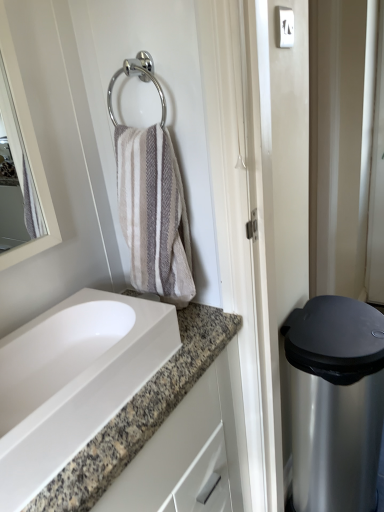
Question: Is chrome metallic towel ring at upper center at the back of satin silver trash can at right?

Choices:
 (A) yes
 (B) no

Answer: (B)

Question: Can you confirm if satin silver trash can at right is thinner than chrome metallic towel ring at upper center?

Choices:
 (A) no
 (B) yes

Answer: (A)

Question: Can you confirm if satin silver trash can at right is wider than chrome metallic towel ring at upper center?

Choices:
 (A) yes
 (B) no

Answer: (A)

Question: Is chrome metallic towel ring at upper center inside satin silver trash can at right?

Choices:
 (A) yes
 (B) no

Answer: (B)

Question: Would you consider satin silver trash can at right to be distant from chrome metallic towel ring at upper center?

Choices:
 (A) no
 (B) yes

Answer: (A)

Question: Does satin silver trash can at right have a greater height compared to chrome metallic towel ring at upper center?

Choices:
 (A) yes
 (B) no

Answer: (A)

Question: Considering the relative positions of white glossy sink at lower left and chrome metallic towel ring at upper center in the image provided, is white glossy sink at lower left to the left of chrome metallic towel ring at upper center from the viewer's perspective?

Choices:
 (A) no
 (B) yes

Answer: (B)

Question: From a real-world perspective, is white glossy sink at lower left under chrome metallic towel ring at upper center?

Choices:
 (A) yes
 (B) no

Answer: (A)

Question: Is white glossy sink at lower left outside of chrome metallic towel ring at upper center?

Choices:
 (A) no
 (B) yes

Answer: (B)

Question: From a real-world perspective, does white glossy sink at lower left stand above chrome metallic towel ring at upper center?

Choices:
 (A) no
 (B) yes

Answer: (A)

Question: Is white glossy sink at lower left shorter than chrome metallic towel ring at upper center?

Choices:
 (A) no
 (B) yes

Answer: (B)

Question: Considering the relative sizes of white glossy sink at lower left and chrome metallic towel ring at upper center in the image provided, is white glossy sink at lower left bigger than chrome metallic towel ring at upper center?

Choices:
 (A) no
 (B) yes

Answer: (B)

Question: Considering the relative positions of chrome metallic towel ring at upper center and white glossy sink at lower left in the image provided, is chrome metallic towel ring at upper center to the left of white glossy sink at lower left from the viewer's perspective?

Choices:
 (A) yes
 (B) no

Answer: (B)